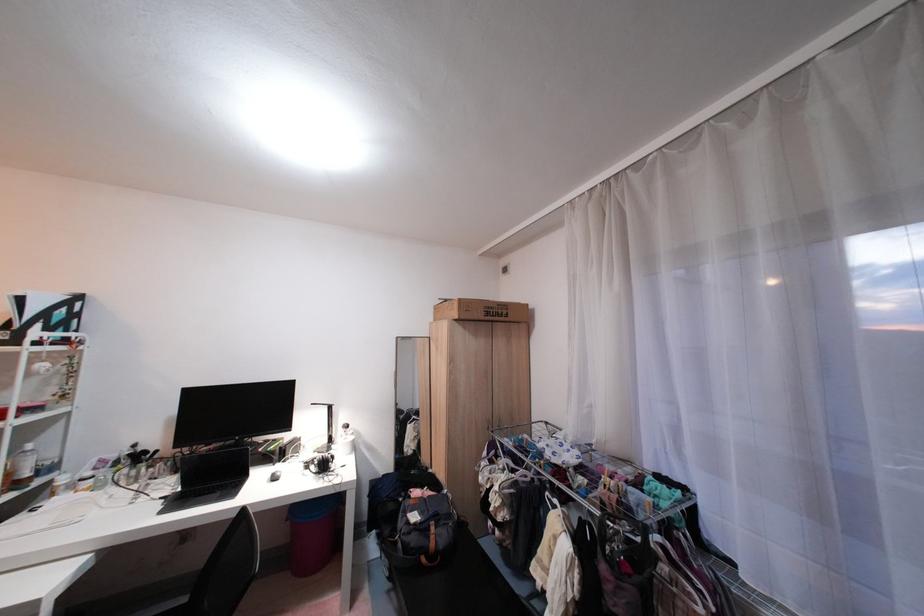
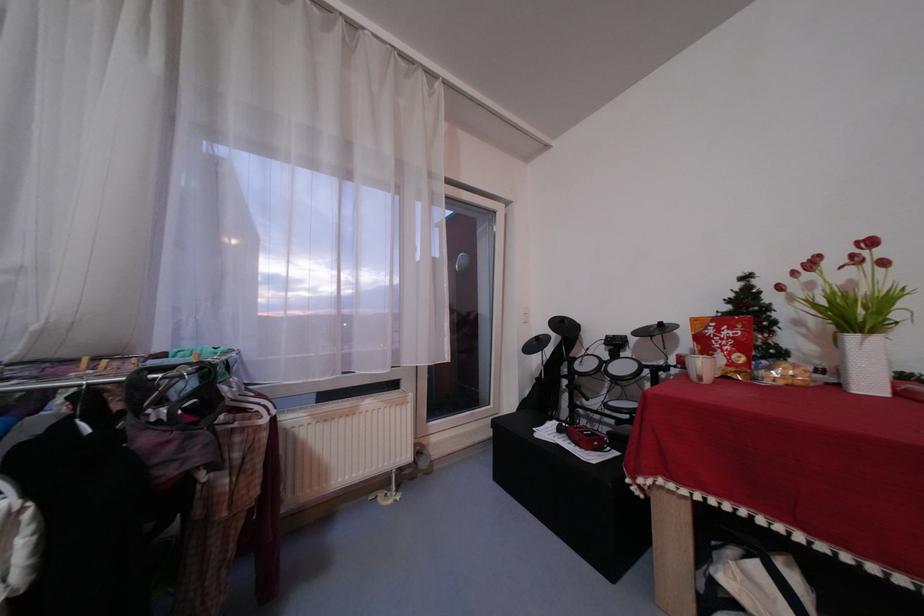
Question: Based on the continuous images, in which direction is the camera rotating? Reply with the corresponding letter.

Choices:
 (A) Left
 (B) Right
 (C) Up
 (D) Down

Answer: (B)